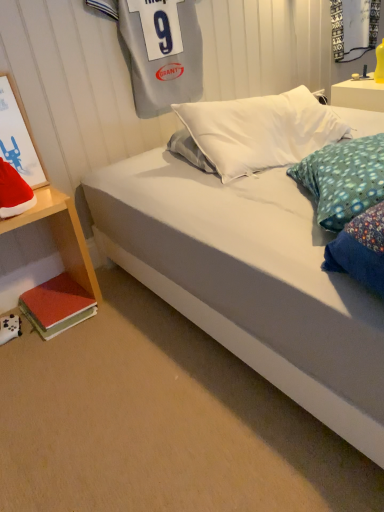
This screenshot has height=512, width=384. What are the coordinates of `free space in front of red matte book at lower left` in the screenshot? It's located at (74, 353).